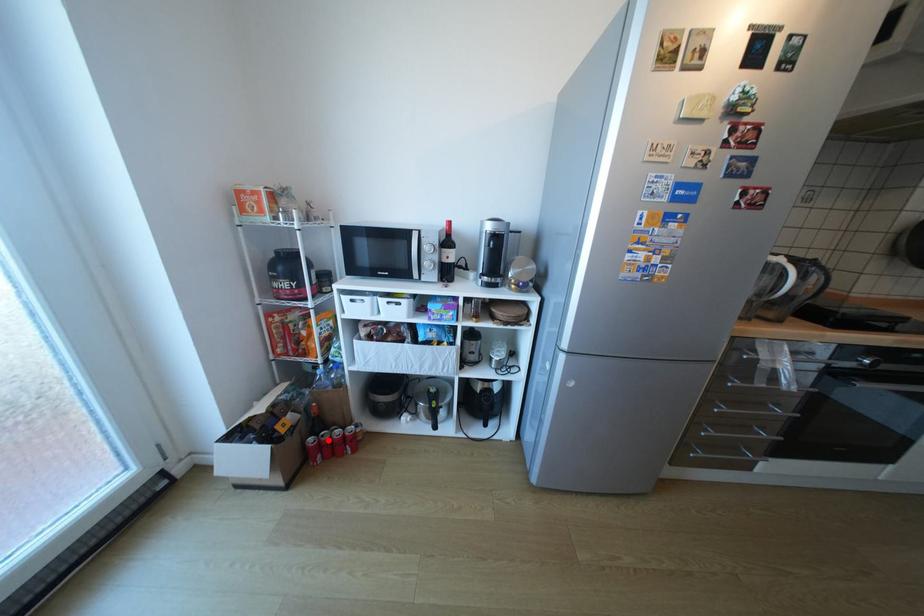
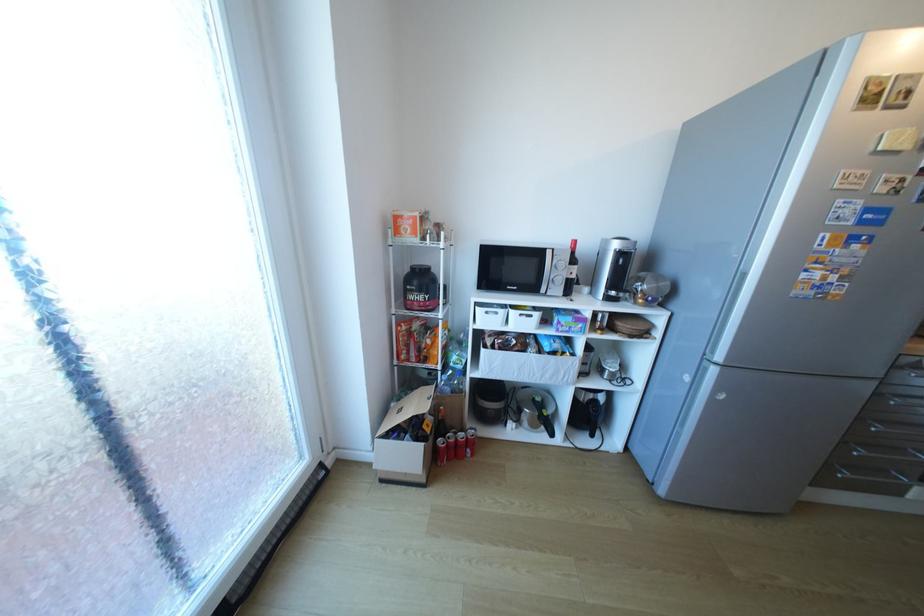
Question: I am providing you with two images of the same scene from different viewpoints. A red point is marked on the first image. Can you still see the location of the red point in image 2?

Choices:
 (A) Yes
 (B) No

Answer: (A)